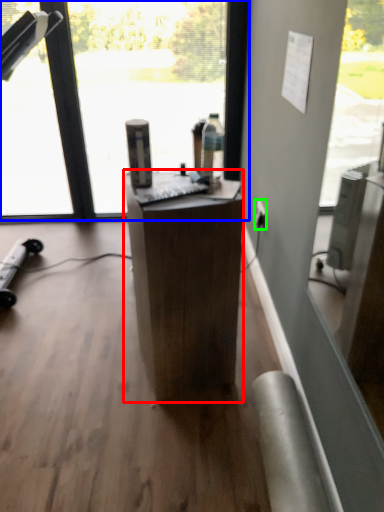
Question: Which object is the closest to the desk (highlighted by a red box)? Choose among these: window (highlighted by a blue box) or power outlet (highlighted by a green box).

Choices:
 (A) window
 (B) power outlet

Answer: (B)